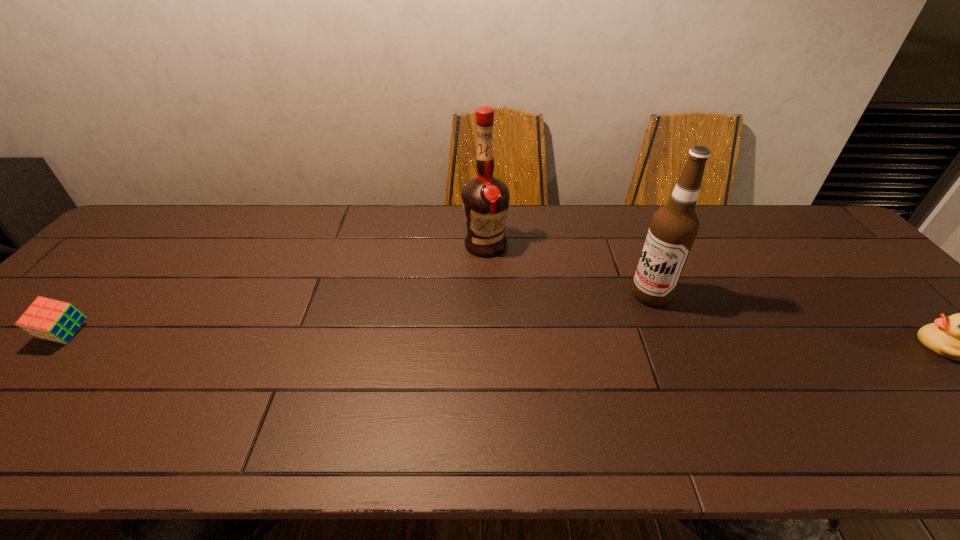
Find the location of `vacant space located on the front and back of the farthest object`. vacant space located on the front and back of the farthest object is located at coordinates (479, 285).

Locate an element on the screen. This screenshot has height=540, width=960. vacant area located 0.190m on the front and back of the farthest object is located at coordinates (476, 306).

Identify the location of object positioned at the far edge. This screenshot has height=540, width=960. (485, 199).

Locate an element on the screen. This screenshot has height=540, width=960. object present at the left edge is located at coordinates coord(53,320).

Locate an element on the screen. vacant space at the far edge of the desktop is located at coordinates (301, 220).

Where is `free space at the near edge of the desktop`? free space at the near edge of the desktop is located at coordinates (268, 412).

You are a GUI agent. You are given a task and a screenshot of the screen. Output one action in this format:
    pyautogui.click(x=<x>, y=<y>)
    Task: Click on the blank area at the left edge
    
    Given the screenshot: What is the action you would take?
    pyautogui.click(x=24, y=376)

Where is `vacant space at the right edge of the desktop`? The image size is (960, 540). vacant space at the right edge of the desktop is located at coordinates (900, 312).

This screenshot has height=540, width=960. I want to click on free space between the third object from right to left and the alcohol, so click(x=567, y=270).

Find the location of `free space that is in between the leftmost object and the second object from left to right`. free space that is in between the leftmost object and the second object from left to right is located at coordinates (276, 290).